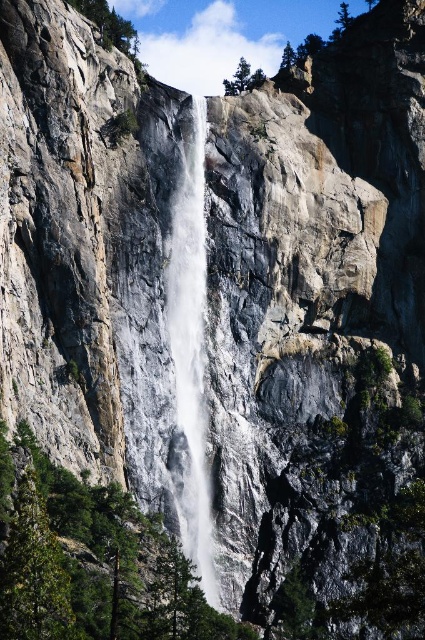
Question: Which point appears farthest from the camera in this image?

Choices:
 (A) (348, 20)
 (B) (153, 522)

Answer: (A)

Question: Estimate the real-world distances between objects in this image. Which object is closer to the green leafy tree at lower left?

Choices:
 (A) green leafy tree at upper left
 (B) green leafy tree at center
 (C) green matte tree at upper center

Answer: (B)

Question: Can you confirm if green leafy tree at upper center is positioned below green leafy tree at upper right?

Choices:
 (A) no
 (B) yes

Answer: (B)

Question: Which point is closer to the camera taking this photo?

Choices:
 (A) (286, 67)
 (B) (206, 556)
 (C) (345, 12)
 (D) (45, 554)

Answer: (D)

Question: Is green leafy tree at upper left below green matte tree at upper center?

Choices:
 (A) no
 (B) yes

Answer: (A)

Question: Is green leafy tree at center closer to the viewer compared to green leafy tree at upper center?

Choices:
 (A) no
 (B) yes

Answer: (B)